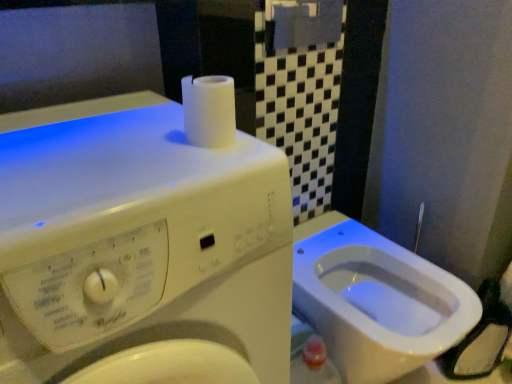
Question: Is white matte toilet paper at upper center at the back of white glossy bidet at lower right?

Choices:
 (A) no
 (B) yes

Answer: (A)

Question: From a real-world perspective, is white glossy bidet at lower right positioned under white matte toilet paper at upper center based on gravity?

Choices:
 (A) yes
 (B) no

Answer: (A)

Question: Is white glossy bidet at lower right to the left of white matte toilet paper at upper center from the viewer's perspective?

Choices:
 (A) no
 (B) yes

Answer: (A)

Question: From the image's perspective, is white glossy bidet at lower right beneath white matte toilet paper at upper center?

Choices:
 (A) yes
 (B) no

Answer: (A)

Question: Can you confirm if white glossy bidet at lower right is positioned to the right of white matte toilet paper at upper center?

Choices:
 (A) yes
 (B) no

Answer: (A)

Question: Is white glossy bidet at lower right shorter than white matte toilet paper at upper center?

Choices:
 (A) no
 (B) yes

Answer: (A)

Question: Does white glossy bidet at lower right have a lesser width compared to white plastic washing machine at upper left?

Choices:
 (A) no
 (B) yes

Answer: (B)

Question: Considering the relative sizes of white glossy bidet at lower right and white plastic washing machine at upper left in the image provided, is white glossy bidet at lower right wider than white plastic washing machine at upper left?

Choices:
 (A) no
 (B) yes

Answer: (A)

Question: Considering the relative sizes of white glossy bidet at lower right and white plastic washing machine at upper left in the image provided, is white glossy bidet at lower right taller than white plastic washing machine at upper left?

Choices:
 (A) no
 (B) yes

Answer: (A)

Question: From a real-world perspective, does white glossy bidet at lower right sit lower than white plastic washing machine at upper left?

Choices:
 (A) no
 (B) yes

Answer: (B)

Question: Does white glossy bidet at lower right have a smaller size compared to white plastic washing machine at upper left?

Choices:
 (A) yes
 (B) no

Answer: (A)

Question: Does white glossy bidet at lower right come in front of white plastic washing machine at upper left?

Choices:
 (A) no
 (B) yes

Answer: (A)

Question: Is white matte toilet paper at upper center oriented towards white glossy bidet at lower right?

Choices:
 (A) no
 (B) yes

Answer: (A)